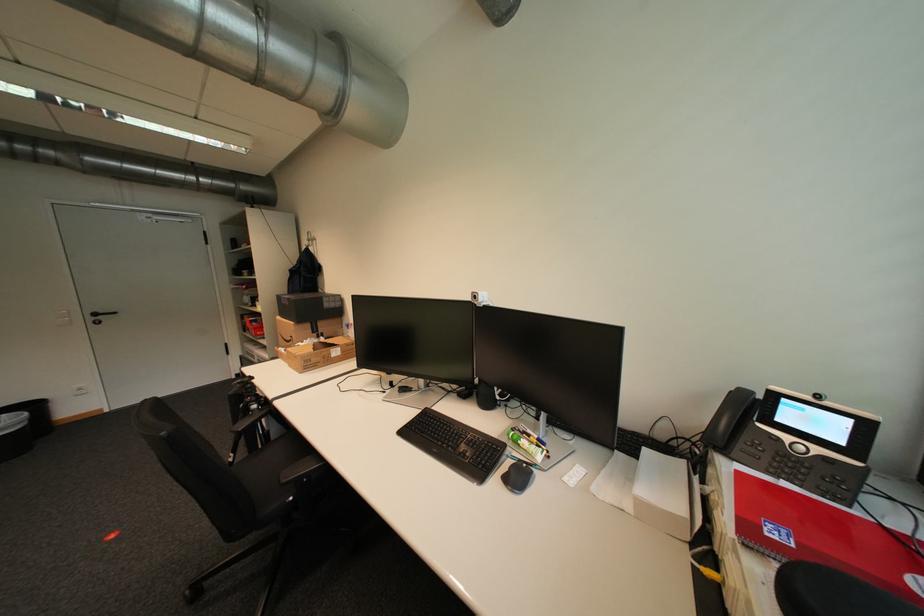
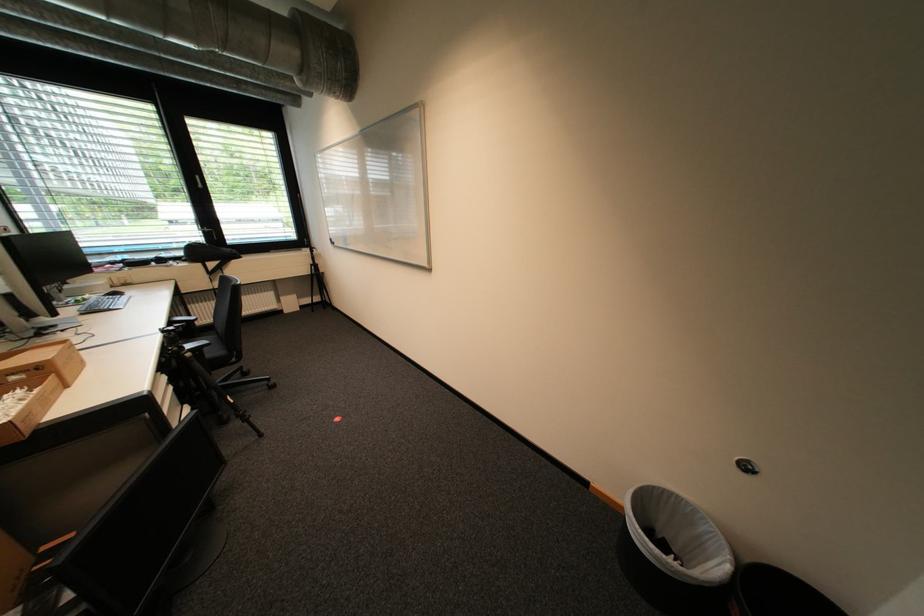
Question: I am providing you with two images of the same scene from different viewpoints. Please identify which objects are invisible in image2.

Choices:
 (A) black trash can
 (B) yellow club headcover
 (C) cardboard box
 (D) phone button

Answer: (D)